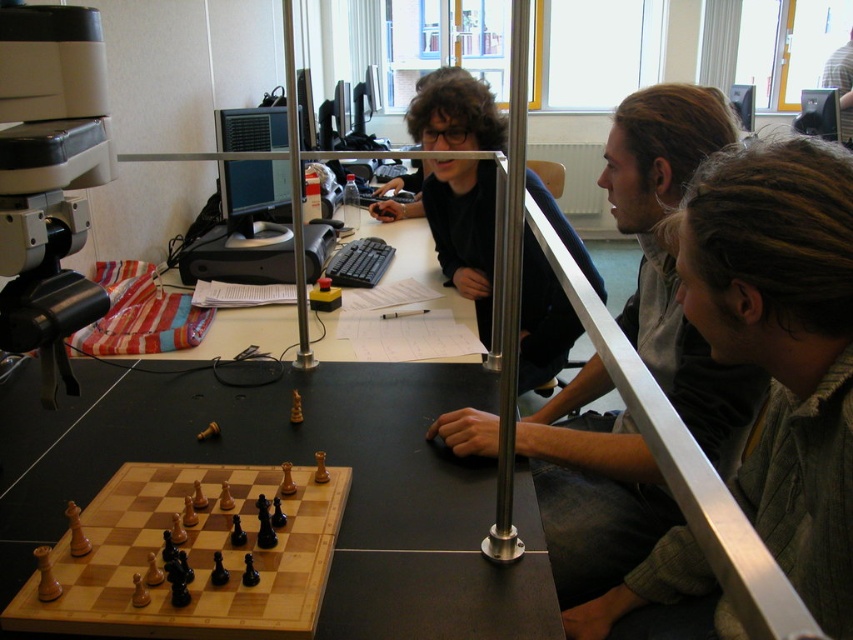
You are a photographer adjusting your camera setup in the classroom. You notice two points marked in the scene. The first point is at coordinate point (9, 433) and the second is at point (579, 573). Which point is closer to your camera lens?

Point (9, 433) is closer to the camera lens because it is further to the camera than point (579, 573).

What is the color of the hair located at the point with coordinates (672, 260)?

The point at coordinates (672, 260) marks dark brown hair at center.

You are a photographer trying to capture a clear shot of the dark brown hair at center and the light brown wood chessboard at lower left. Since the metallic structure is blocking your view, which object would you need to adjust your angle to see better?

The dark brown hair at center is taller than the light brown wood chessboard at lower left, so you would need to adjust your angle to see the dark brown hair at center better as it is higher and might be more obscured by the metallic structure.